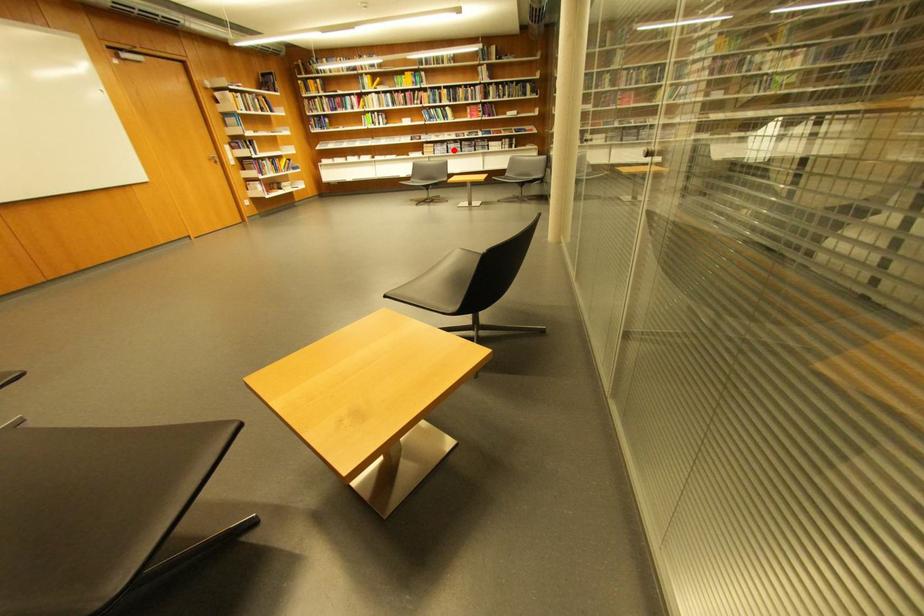
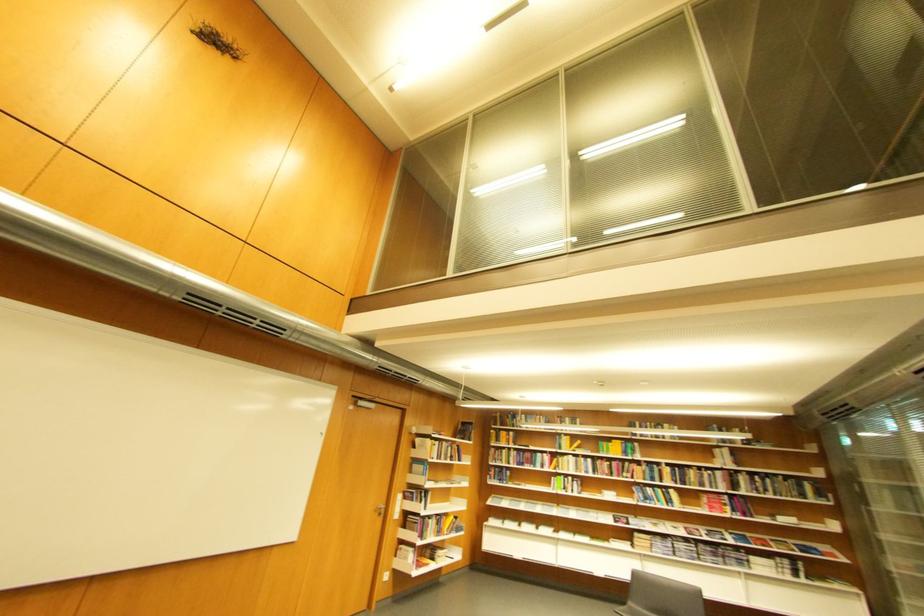
Find the pixel in the second image that matches the highlighted location in the first image.

(677, 549)